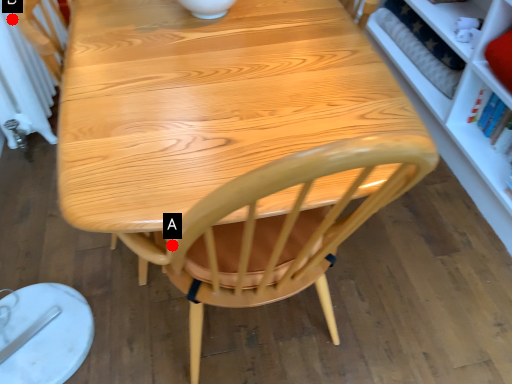
Question: Two points are circled on the image, labeled by A and B beside each circle. Which point is closer to the camera?

Choices:
 (A) A is closer
 (B) B is closer

Answer: (A)